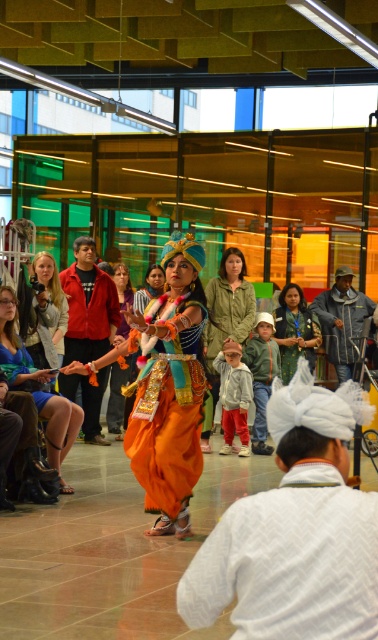
Question: In this image, where is red jacket at center located relative to red velvet pants at center?

Choices:
 (A) right
 (B) left

Answer: (B)

Question: Is matte blue dress at center further to the viewer compared to green fabric dress at center?

Choices:
 (A) yes
 (B) no

Answer: (B)

Question: Among these points, which one is farthest from the camera?

Choices:
 (A) (297, 349)
 (B) (212, 332)
 (C) (26, 348)

Answer: (A)

Question: Which is nearer to the light gray fleece jacket at center?

Choices:
 (A) matte blue dress at center
 (B) red velvet pants at center

Answer: (B)

Question: Which of the following is the farthest from the observer?

Choices:
 (A) white textured turban at lower center
 (B) matte black camera at upper left

Answer: (B)

Question: Does matte blue dress at center come behind red velvet pants at center?

Choices:
 (A) no
 (B) yes

Answer: (A)